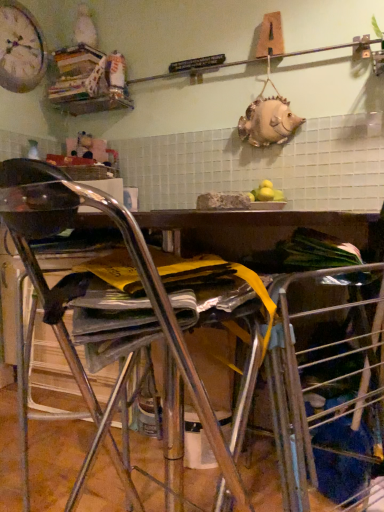
Question: Is point (36, 284) closer or farther from the camera than point (36, 70)?

Choices:
 (A) farther
 (B) closer

Answer: (B)

Question: Looking at the image, does metallic silver chair at center seem bigger or smaller compared to matte white clock at upper left?

Choices:
 (A) small
 (B) big

Answer: (B)

Question: Which of these objects is positioned farthest from the metallic silver chair at center?

Choices:
 (A) matte white clock at upper left
 (B) wooden bookshelf at upper left

Answer: (A)

Question: Which is nearer to the metallic silver chair at center?

Choices:
 (A) matte white clock at upper left
 (B) wooden bookshelf at upper left

Answer: (B)